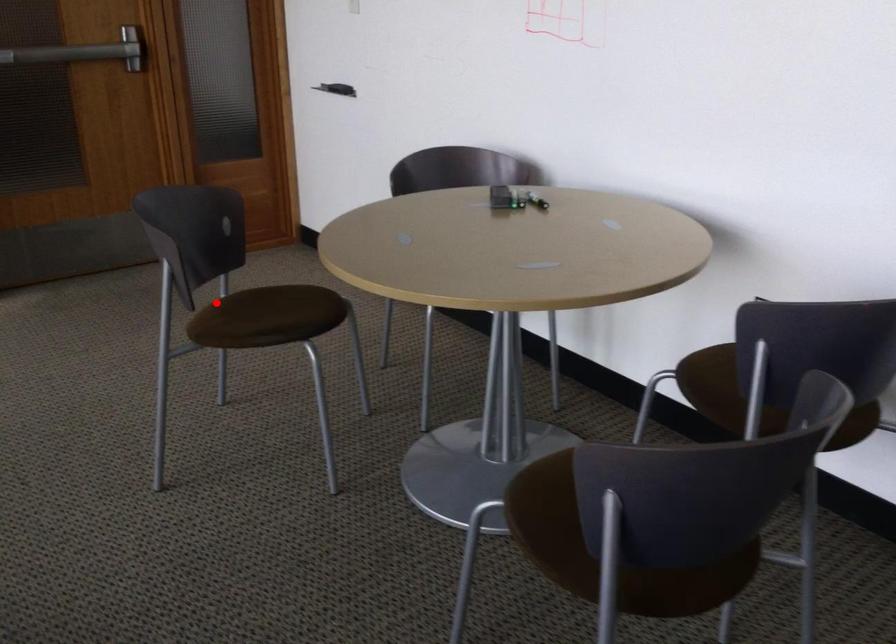
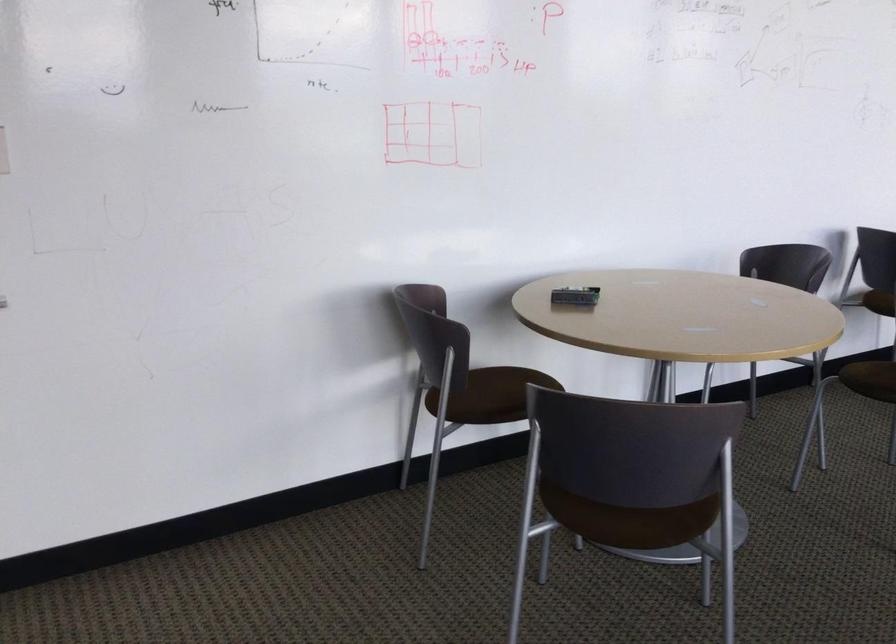
In the second image, find the point that corresponds to the highlighted location in the first image.

(633, 505)